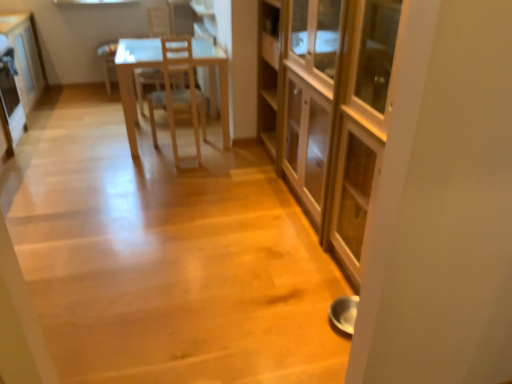
Question: From the image's perspective, is white glossy cabinet at upper left, the first cabinetry when ordered from left to right, located above matte wooden cabinet at center, which is the first cabinetry from right to left?

Choices:
 (A) no
 (B) yes

Answer: (B)

Question: Is matte wooden cabinet at center, which appears as the second cabinetry when viewed from the back, completely or partially inside white glossy cabinet at upper left, the 2th cabinetry from the front?

Choices:
 (A) yes
 (B) no

Answer: (B)

Question: From the image's perspective, is white glossy cabinet at upper left, the first cabinetry when ordered from left to right, under matte wooden cabinet at center, which appears as the second cabinetry when viewed from the back?

Choices:
 (A) yes
 (B) no

Answer: (B)

Question: Does white glossy cabinet at upper left, the second cabinetry when ordered from right to left, turn towards matte wooden cabinet at center, marked as the 1th cabinetry in a front-to-back arrangement?

Choices:
 (A) yes
 (B) no

Answer: (B)

Question: Considering the relative sizes of white glossy cabinet at upper left, the first cabinetry when ordered from left to right, and matte wooden cabinet at center, which is the first cabinetry from right to left, in the image provided, is white glossy cabinet at upper left, the first cabinetry when ordered from left to right, bigger than matte wooden cabinet at center, which is the first cabinetry from right to left,?

Choices:
 (A) no
 (B) yes

Answer: (A)

Question: Is white glossy cabinet at upper left, the first cabinetry when ordered from left to right, behind matte wooden cabinet at center, marked as the 1th cabinetry in a front-to-back arrangement?

Choices:
 (A) yes
 (B) no

Answer: (A)

Question: Considering the relative positions of matte wooden cabinet at center, which is the first cabinetry from right to left, and wooden chair at center in the image provided, is matte wooden cabinet at center, which is the first cabinetry from right to left, in front of wooden chair at center?

Choices:
 (A) no
 (B) yes

Answer: (B)

Question: Is matte wooden cabinet at center, which is the first cabinetry from right to left, in contact with wooden chair at center?

Choices:
 (A) yes
 (B) no

Answer: (B)

Question: Is matte wooden cabinet at center, the second cabinetry positioned from the left, turned away from wooden chair at center?

Choices:
 (A) no
 (B) yes

Answer: (A)

Question: From a real-world perspective, is matte wooden cabinet at center, which appears as the second cabinetry when viewed from the back, under wooden chair at center?

Choices:
 (A) no
 (B) yes

Answer: (A)

Question: Is matte wooden cabinet at center, which is the first cabinetry from right to left, thinner than wooden chair at center?

Choices:
 (A) yes
 (B) no

Answer: (B)

Question: Can you confirm if matte wooden cabinet at center, the second cabinetry positioned from the left, is taller than wooden chair at center?

Choices:
 (A) no
 (B) yes

Answer: (B)

Question: Can you confirm if matte wooden cabinet at center, which is the first cabinetry from right to left, is bigger than metallic refrigerator at left?

Choices:
 (A) yes
 (B) no

Answer: (A)